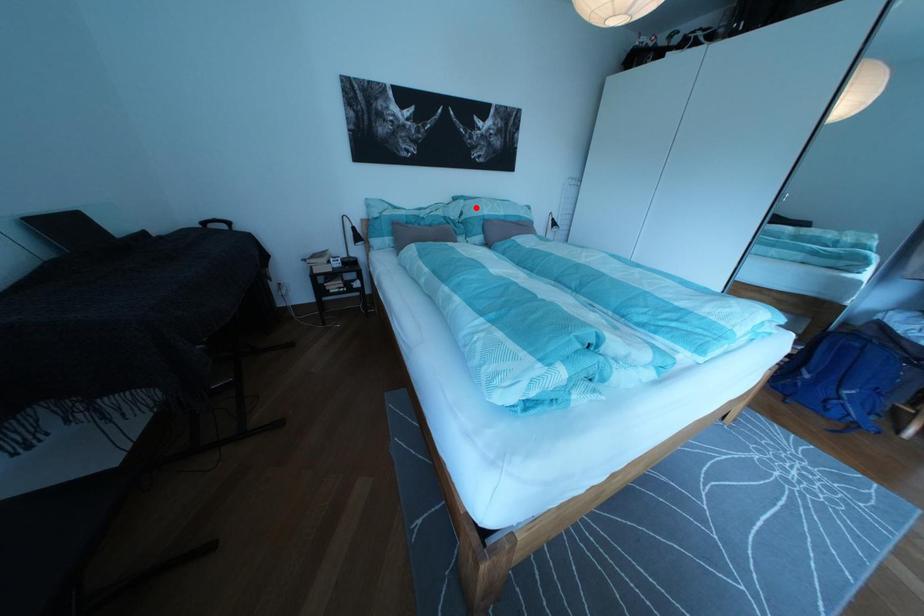
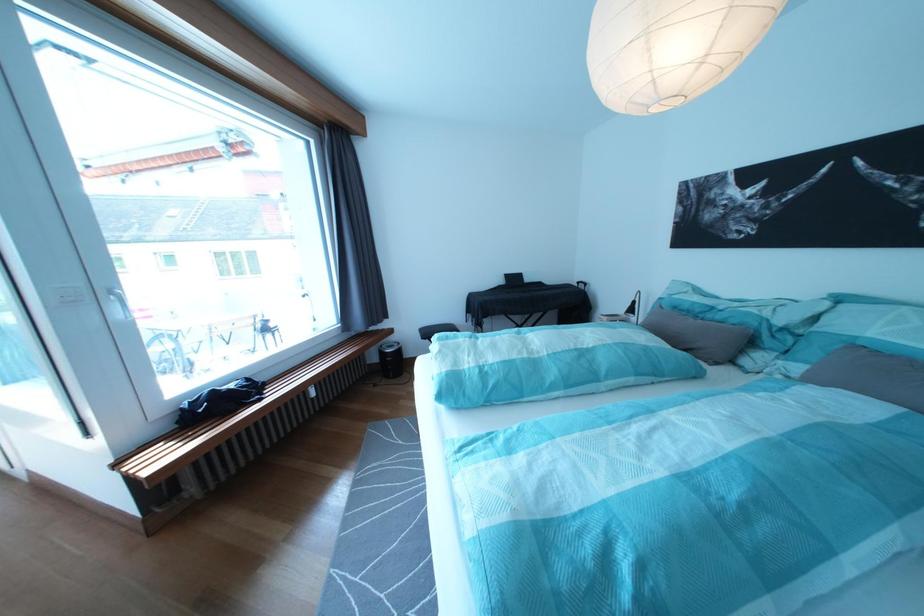
Where in the second image is the point corresponding to the highlighted location from the first image?

(841, 309)